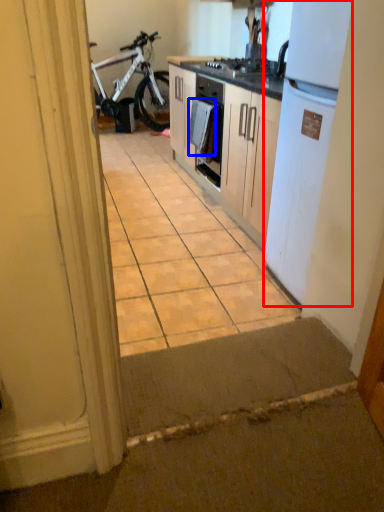
Question: Which object is further to the camera taking this photo, refrigerator (highlighted by a red box) or towel/napkin (highlighted by a blue box)?

Choices:
 (A) refrigerator
 (B) towel/napkin

Answer: (B)